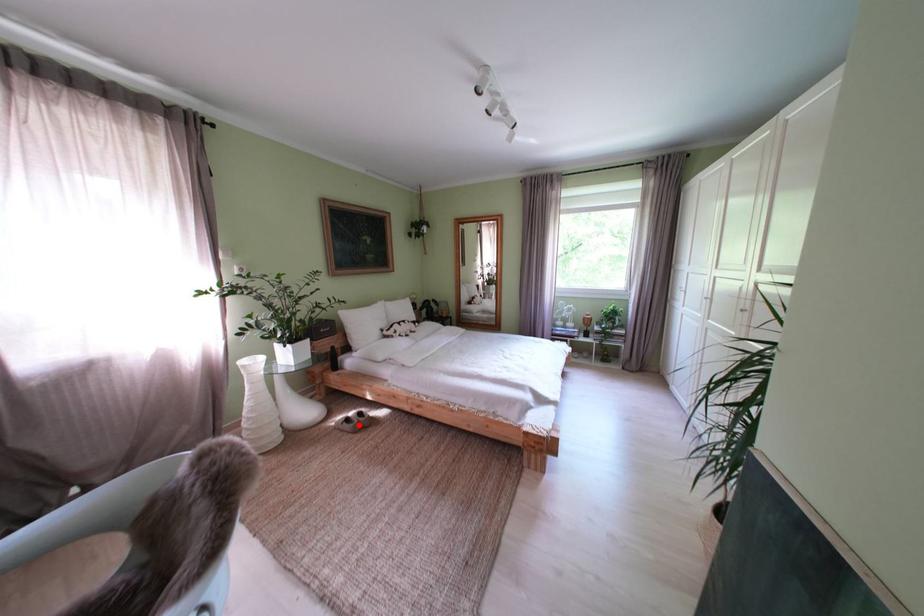
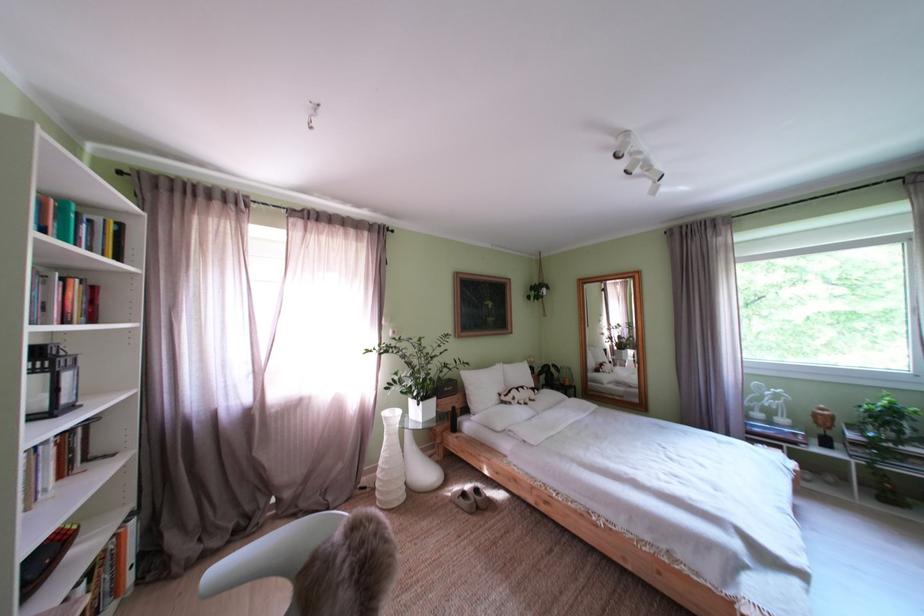
Question: I am providing you with two images of the same scene from different viewpoints. Given a red point in image1, look at the same physical point in image2. Is it:

Choices:
 (A) Closer to the viewpoint
 (B) Farther from the viewpoint

Answer: (A)